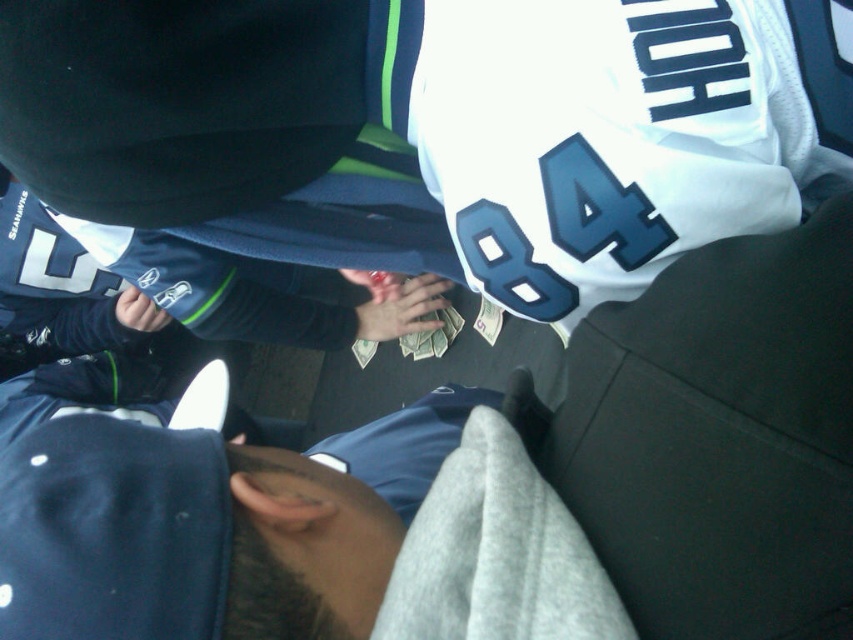
Question: Is the position of white jersey at upper center less distant than that of dark blue fabric at center?

Choices:
 (A) no
 (B) yes

Answer: (A)

Question: Is white jersey at upper center smaller than dark blue fabric at center?

Choices:
 (A) no
 (B) yes

Answer: (A)

Question: Does white jersey at upper center have a lesser width compared to dark blue fabric at center?

Choices:
 (A) no
 (B) yes

Answer: (A)